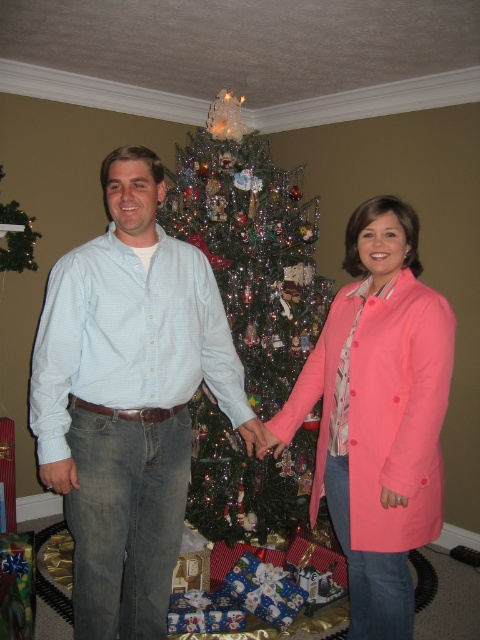
Between light blue button-down shirt at center and coral fabric coat at center, which one has more height?

With more height is light blue button-down shirt at center.

Is point (171, 563) positioned before point (352, 588)?

Yes, it is.

This screenshot has height=640, width=480. Identify the location of light blue button-down shirt at center. (129, 397).

Is light blue button-down shirt at center smaller than green metallic christmas tree at center?

Yes, light blue button-down shirt at center is smaller than green metallic christmas tree at center.

Which is behind, point (47, 401) or point (297, 193)?

Point (297, 193)

Identify the location of light blue button-down shirt at center. The image size is (480, 640). (129, 397).

In order to click on light blue button-down shirt at center in this screenshot , I will do `click(129, 397)`.

Does coral fabric coat at center appear under green metallic christmas tree at center?

Yes.

Between coral fabric coat at center and green metallic christmas tree at center, which one is positioned lower?

coral fabric coat at center

Who is more distant from viewer, (320, 435) or (208, 404)?

Point (208, 404)

Image resolution: width=480 pixels, height=640 pixels. I want to click on coral fabric coat at center, so click(x=377, y=413).